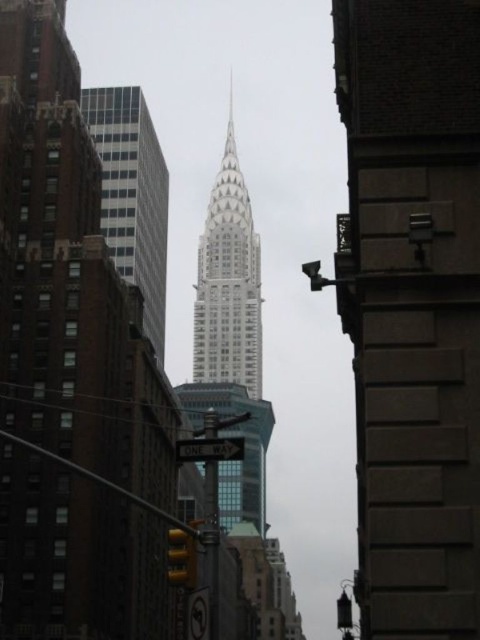
Question: Which object is the closest to the glassy steel skyscraper at center?

Choices:
 (A) smooth stone tower at center
 (B) white glass skyscraper at upper center

Answer: (B)

Question: Can you confirm if white glass skyscraper at upper center is positioned to the left of glassy steel skyscraper at center?

Choices:
 (A) yes
 (B) no

Answer: (A)

Question: Is smooth stone tower at center below white glass skyscraper at upper center?

Choices:
 (A) no
 (B) yes

Answer: (B)

Question: Which point is farther from the camera taking this photo?

Choices:
 (A) (124, 180)
 (B) (194, 560)
 (C) (377, 221)

Answer: (A)

Question: Is glassy steel skyscraper at center positioned before yellow matte traffic light at lower center?

Choices:
 (A) no
 (B) yes

Answer: (A)

Question: Among these points, which one is nearest to the camera?

Choices:
 (A) (116, 170)
 (B) (177, 554)

Answer: (B)